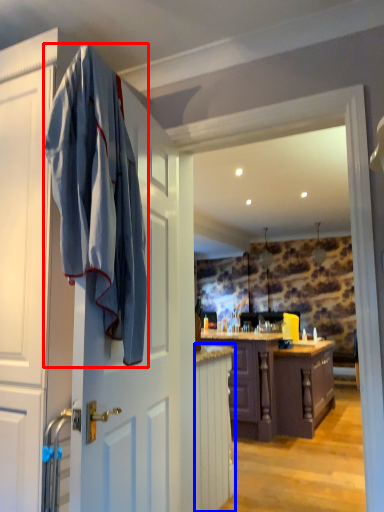
Question: Which object appears farthest to the camera in this image, bath towel (highlighted by a red box) or cabinetry (highlighted by a blue box)?

Choices:
 (A) bath towel
 (B) cabinetry

Answer: (B)